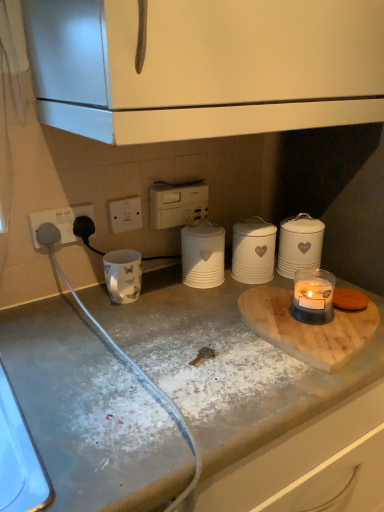
At what (x,y) coordinates should I click in order to perform the action: click on vacant region to the left of wooden cutting board at center. Please return your answer as a coordinate pair (x, y). The width and height of the screenshot is (384, 512). Looking at the image, I should click on (179, 331).